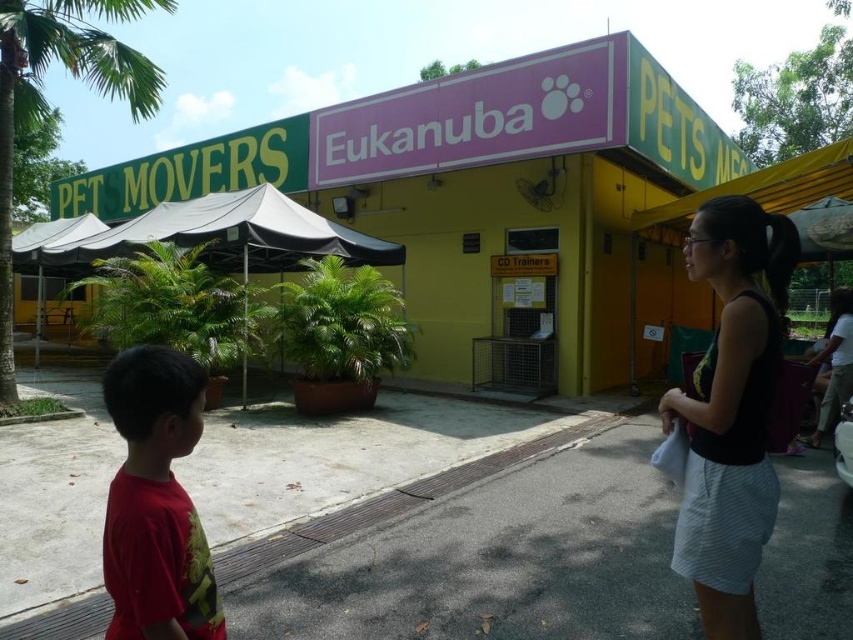
Question: In this image, where is black fabric top at center located relative to red matte shirt at lower left?

Choices:
 (A) left
 (B) right

Answer: (B)

Question: Among these points, which one is farthest from the camera?

Choices:
 (A) (107, 531)
 (B) (589, 241)
 (C) (94, 51)
 (D) (683, 397)

Answer: (B)

Question: Is pink matte sign at center to the right of red matte shirt at lower left from the viewer's perspective?

Choices:
 (A) yes
 (B) no

Answer: (B)

Question: Which is nearer to the pink matte sign at center?

Choices:
 (A) black fabric top at center
 (B) green leafy palm tree at upper left

Answer: (B)

Question: Which object is farther from the camera taking this photo?

Choices:
 (A) green leafy palm tree at upper left
 (B) black fabric top at center
 (C) red matte shirt at lower left

Answer: (A)

Question: Can you confirm if black fabric top at center is wider than red matte shirt at lower left?

Choices:
 (A) no
 (B) yes

Answer: (B)